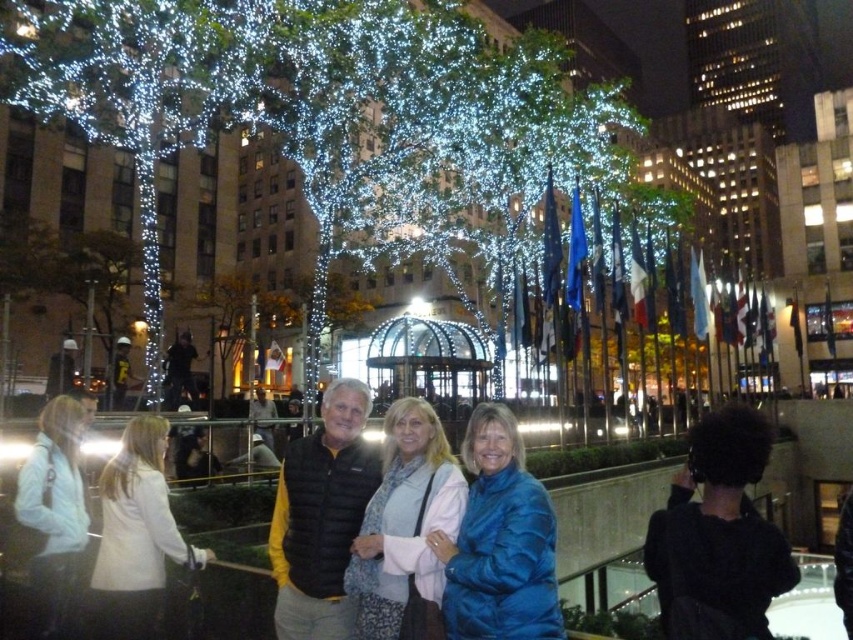
From the picture: You are a photographer trying to capture a group photo of the black puffer vest at center and the white fabric jacket at lower left. Which person should you position closer to the camera to ensure their full width fits in the frame?

The black puffer vest at center has a smaller width than the white fabric jacket at lower left, so you should position the person wearing the black puffer vest at center closer to the camera to ensure their full width fits in the frame.

You are standing in the plaza and want to take a photo of the black puffer vest at center. If your camera has a maximum focus range of 90 feet, will it be able to focus on the subject?

The black puffer vest at center and viewer are 89.38 feet apart, so yes, the camera can focus on the subject since the distance is within the 90 feet range.

In the image of the urban night scene, there are three people standing in the foreground. The man on the left is wearing a black puffer jacket over a yellow shirt, and the two women beside him are in light colored jackets. The black puffer vest at center is represented by point (321, 516). Your task is to determine which of the three individuals is wearing the black puffer vest at center. Please provide your answer based on the coordinates provided.

The black puffer vest at center is represented by point (321, 516), which corresponds to the man on the left who is wearing the black puffer jacket over a yellow shirt.